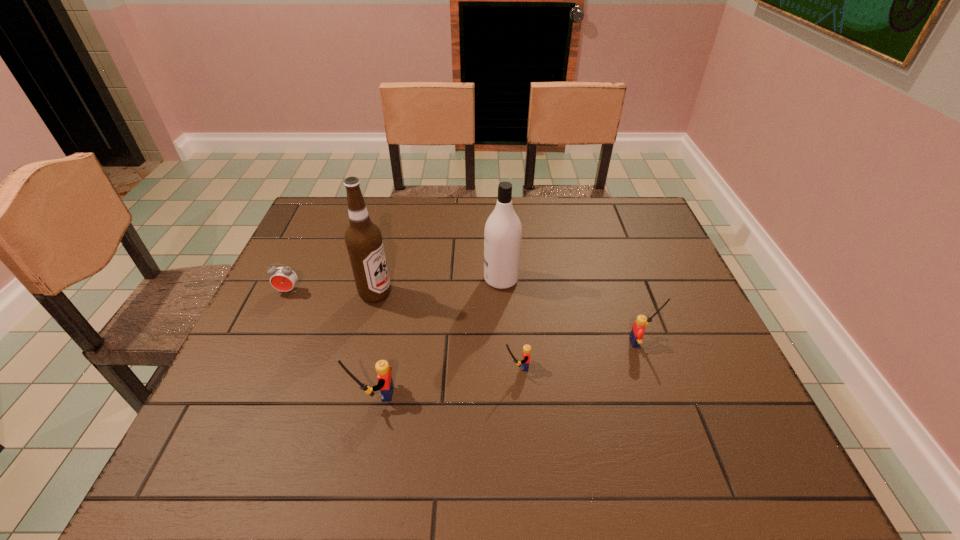
Locate which object is the second closest to the alcohol. Please provide its 2D coordinates. Your answer should be formatted as a tuple, i.e. [(x, y)], where the tuple contains the x and y coordinates of a point satisfying the conditions above.

[(385, 383)]

I want to click on the closest Lego to the second nearest Lego, so click(x=385, y=383).

The width and height of the screenshot is (960, 540). I want to click on Lego that is the closest to the alcohol, so [x=385, y=383].